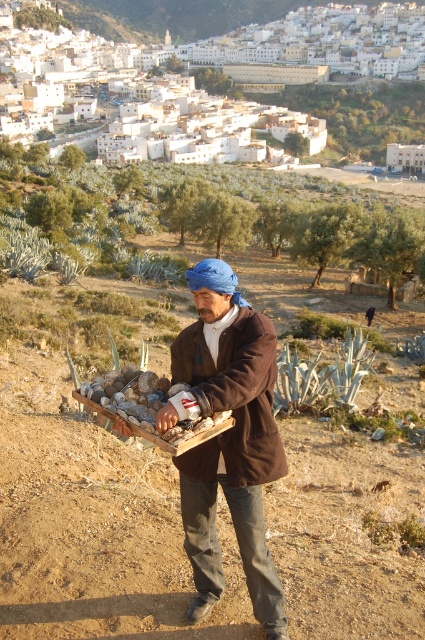
Is the position of brown woolen coat at center less distant than that of brown woolen jacket at center?

Yes.

From the picture: Is brown woolen coat at center shorter than brown woolen jacket at center?

No.

Is point (260, 470) farther from viewer compared to point (235, 385)?

Yes, it is behind point (235, 385).

Where is `brown woolen coat at center`? brown woolen coat at center is located at coordinates (227, 438).